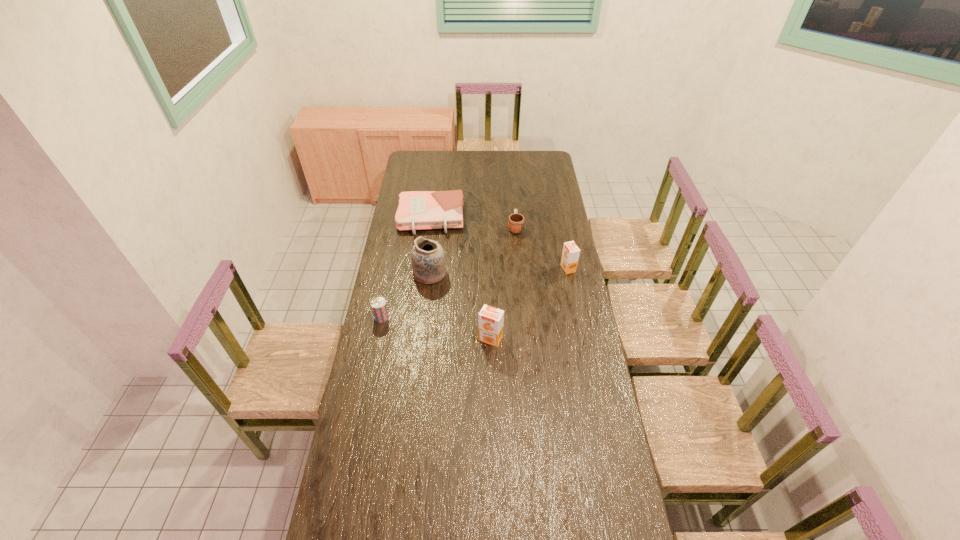
Where is `vacant region at the left edge of the desktop`? vacant region at the left edge of the desktop is located at coordinates (429, 190).

This screenshot has height=540, width=960. Find the location of `vacant space at the right edge of the desktop`. vacant space at the right edge of the desktop is located at coordinates (551, 281).

You are a GUI agent. You are given a task and a screenshot of the screen. Output one action in this format:
    pyautogui.click(x=<x>, y=<y>)
    Task: Click on the vacant area that lies between the farther orange juice and the left orange juice
    This screenshot has height=540, width=960.
    Given the screenshot: What is the action you would take?
    pyautogui.click(x=529, y=303)

This screenshot has height=540, width=960. I want to click on free area in between the third tallest object and the pottery, so 499,271.

Image resolution: width=960 pixels, height=540 pixels. What are the coordinates of `free space between the second object from right to left and the fifth farthest object` in the screenshot? It's located at (448, 272).

Locate an element on the screen. vacant space that's between the pottery and the fourth object from left to right is located at coordinates (460, 306).

At what (x,y) coordinates should I click in order to perform the action: click on free space that is in between the second nearest object and the taller orange juice. Please return your answer as a coordinate pair (x, y). Looking at the image, I should click on (436, 328).

This screenshot has width=960, height=540. I want to click on vacant space that is in between the nearer orange juice and the pottery, so click(x=460, y=306).

Locate an element on the screen. free space between the mug and the pottery is located at coordinates (472, 251).

The width and height of the screenshot is (960, 540). I want to click on free space between the nearest object and the fifth object from left to right, so click(x=503, y=283).